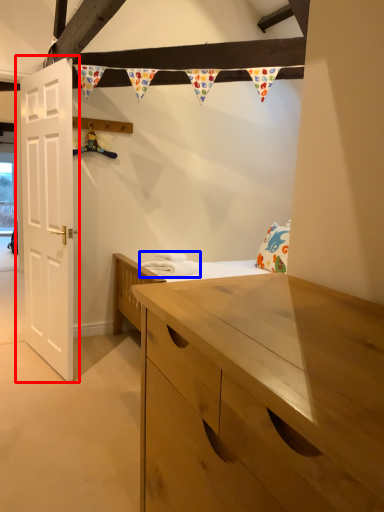
Question: Which point is further to the camera, door (highlighted by a red box) or laundry (highlighted by a blue box)?

Choices:
 (A) door
 (B) laundry

Answer: (B)